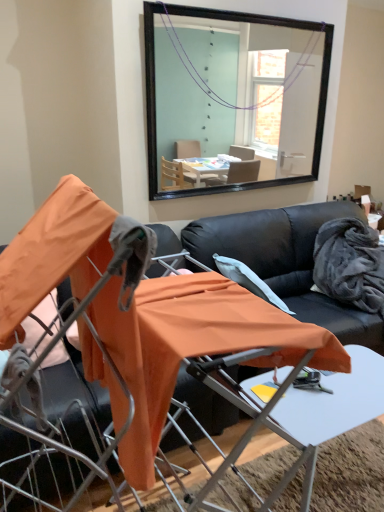
Question: Is orange fabric table at center taller than black leather couch at center?

Choices:
 (A) no
 (B) yes

Answer: (A)

Question: Is orange fabric table at center positioned with its back to black leather couch at center?

Choices:
 (A) no
 (B) yes

Answer: (B)

Question: From the image's perspective, does orange fabric table at center appear lower than black leather couch at center?

Choices:
 (A) yes
 (B) no

Answer: (A)

Question: Does orange fabric table at center lie behind black leather couch at center?

Choices:
 (A) no
 (B) yes

Answer: (A)

Question: Is orange fabric table at center next to black leather couch at center?

Choices:
 (A) no
 (B) yes

Answer: (A)

Question: Is orange fabric table at center positioned beyond the bounds of black leather couch at center?

Choices:
 (A) yes
 (B) no

Answer: (A)

Question: Considering the relative sizes of black leather couch at center and orange fabric chair at center, positioned as the second chair in left-to-right order, in the image provided, is black leather couch at center thinner than orange fabric chair at center, positioned as the second chair in left-to-right order,?

Choices:
 (A) no
 (B) yes

Answer: (A)

Question: Is black leather couch at center next to orange fabric chair at center, positioned as the second chair in left-to-right order?

Choices:
 (A) no
 (B) yes

Answer: (A)

Question: From the image's perspective, would you say black leather couch at center is shown under orange fabric chair at center, positioned as the second chair in left-to-right order?

Choices:
 (A) yes
 (B) no

Answer: (B)

Question: Does black leather couch at center have a greater width compared to orange fabric chair at center, positioned as the second chair in left-to-right order?

Choices:
 (A) yes
 (B) no

Answer: (A)

Question: Is the depth of black leather couch at center less than that of orange fabric chair at center, the first chair when ordered from right to left?

Choices:
 (A) yes
 (B) no

Answer: (B)

Question: From a real-world perspective, is black leather couch at center positioned over orange fabric chair at center, positioned as the second chair in left-to-right order, based on gravity?

Choices:
 (A) no
 (B) yes

Answer: (A)

Question: Is orange fabric chair at center, the 1th chair when ordered from left to right, positioned with its back to black leather couch at center?

Choices:
 (A) yes
 (B) no

Answer: (B)